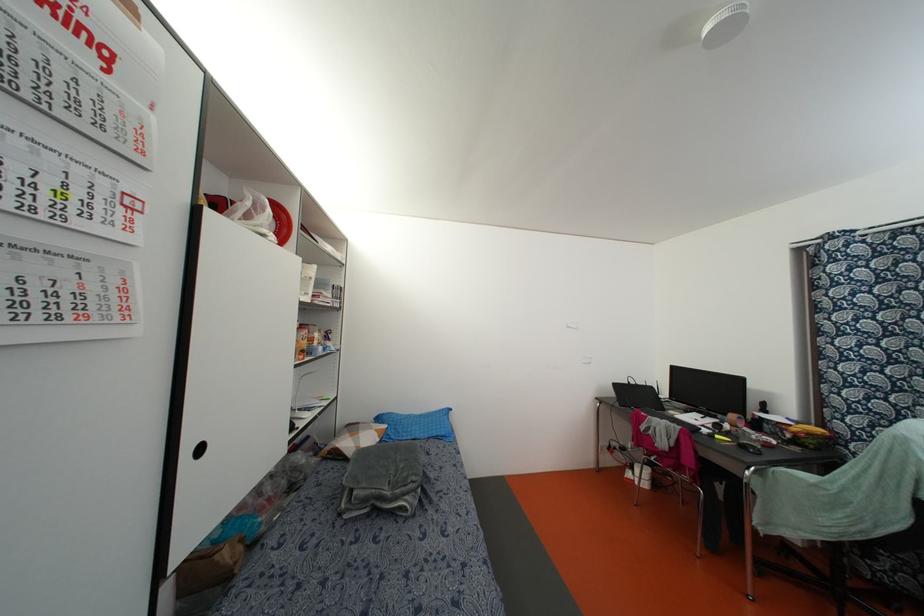
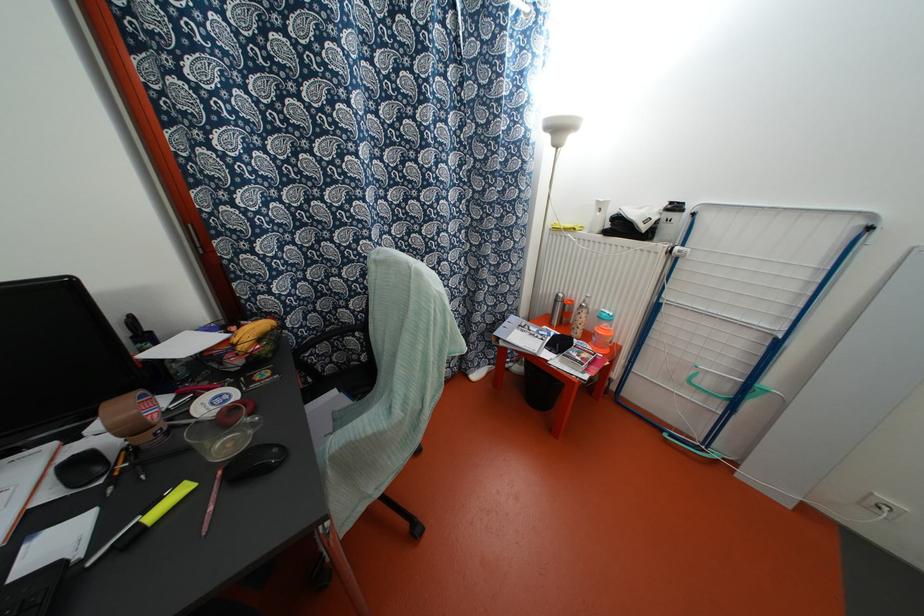
In the second image, find the point that corresponds to [716,436] in the first image.

(152, 515)